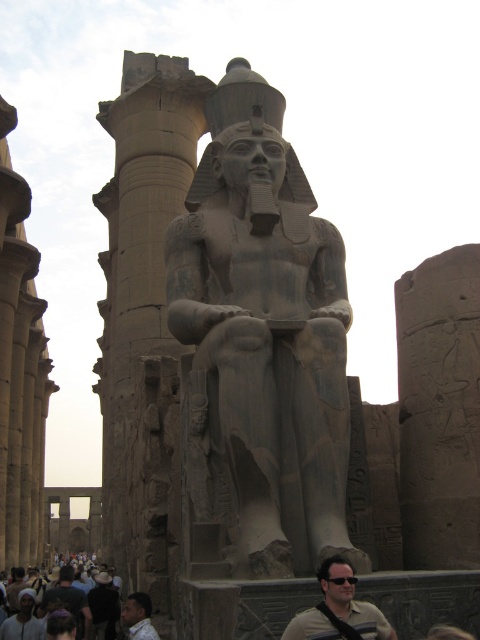
You are an archaeologist examining the ancient Egyptian statue. You notice two points on the statue marked as point 1 at coordinates (92,602) and point 2 at coordinates (62,592). Which point is nearer to your viewpoint?

Point 1 at coordinates (92,602) is closer to the camera than point 2 at coordinates (62,592).

You are an archaeologist examining the ancient Egyptian statue. You notice a point marked at coordinates (144, 314). What does this point indicate?

The point at coordinates (144, 314) marks the gray stone column at center.